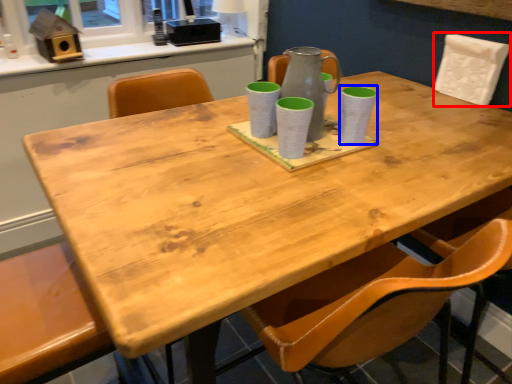
Question: Among these objects, which one is farthest to the camera, chair (highlighted by a red box) or mug (highlighted by a blue box)?

Choices:
 (A) chair
 (B) mug

Answer: (A)